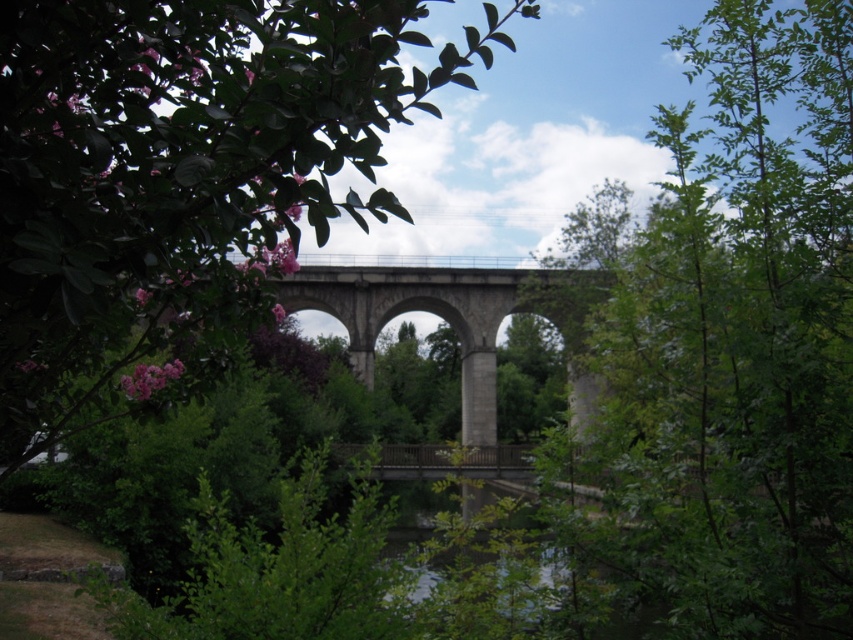
Question: Can you confirm if green leafy tree at upper center is smaller than gray stone bridge at center?

Choices:
 (A) yes
 (B) no

Answer: (A)

Question: Which point appears farthest from the camera in this image?

Choices:
 (A) (695, 307)
 (B) (495, 417)

Answer: (B)

Question: Does green leafy tree at upper center have a larger size compared to green leafy tree at center?

Choices:
 (A) yes
 (B) no

Answer: (B)

Question: Which object appears closest to the camera in this image?

Choices:
 (A) green leafy tree at center
 (B) green leafy tree at upper center

Answer: (B)

Question: Which point is closer to the camera?

Choices:
 (A) green leafy tree at center
 (B) gray stone bridge at center
 (C) green leafy tree at upper center

Answer: (C)

Question: Does green leafy tree at center have a larger size compared to gray stone bridge at center?

Choices:
 (A) no
 (B) yes

Answer: (B)